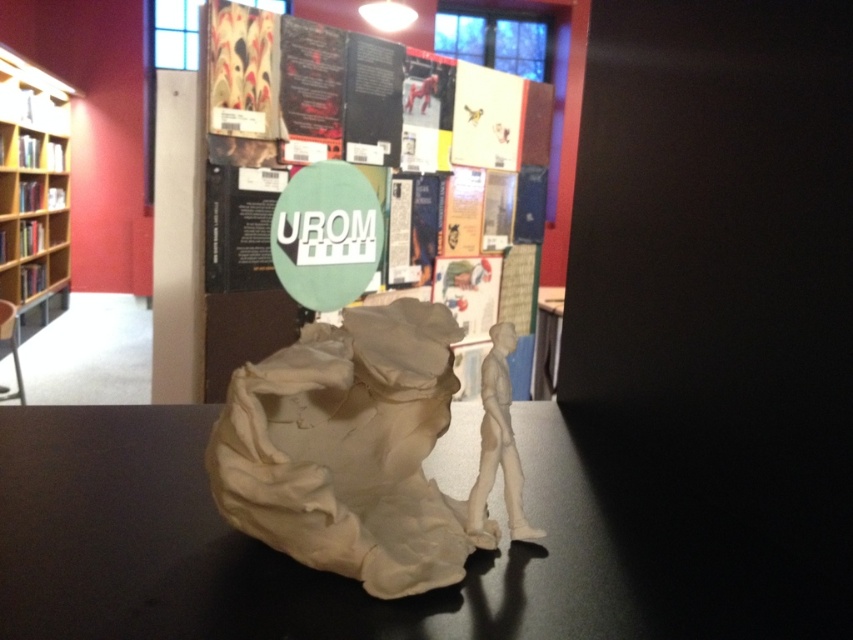
Question: Which object appears farthest from the camera in this image?

Choices:
 (A) matte beige sculpture at center
 (B) beige matte sculpture at center
 (C) green matte sign at center
 (D) wooden bookshelf at left

Answer: (D)

Question: Which of these objects is positioned closest to the green matte sign at center?

Choices:
 (A) wooden bookshelf at left
 (B) beige matte sculpture at center

Answer: (B)

Question: Which of the following is the closest to the observer?

Choices:
 (A) [51, 554]
 (B) [38, 141]
 (C) [463, 124]

Answer: (A)

Question: Can you confirm if beige matte sculpture at center is positioned to the right of matte beige sculpture at center?

Choices:
 (A) yes
 (B) no

Answer: (B)

Question: Observing the image, what is the correct spatial positioning of matte beige sculpture at center in reference to green matte sign at center?

Choices:
 (A) right
 (B) left

Answer: (A)

Question: Considering the relative positions of matte beige sculpture at center and green matte sign at center in the image provided, where is matte beige sculpture at center located with respect to green matte sign at center?

Choices:
 (A) above
 (B) below

Answer: (B)